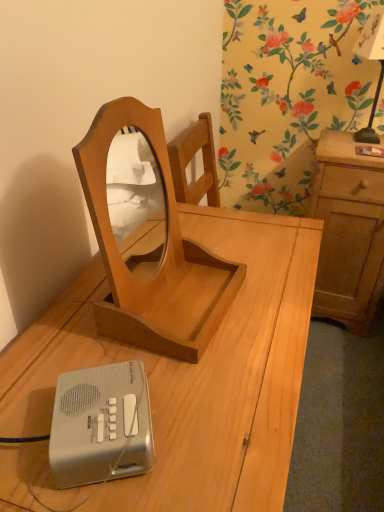
This screenshot has height=512, width=384. I want to click on blank space to the left of silver plastic ipod at lower left, so click(26, 416).